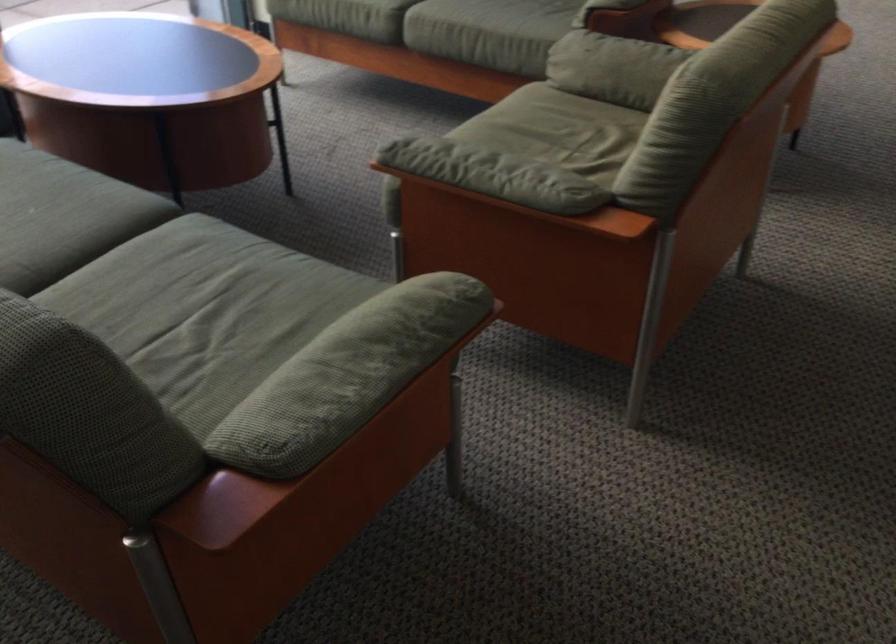
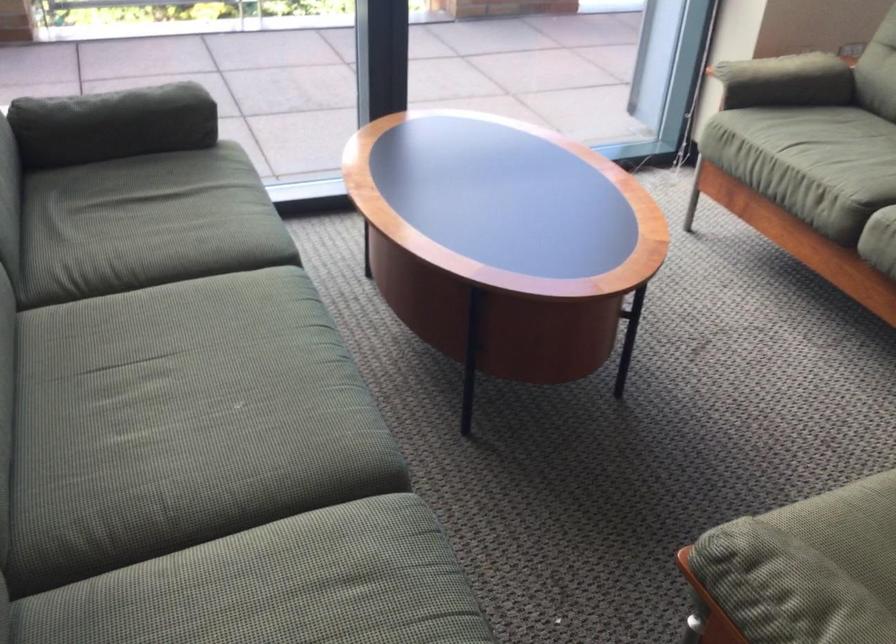
Locate, in the second image, the point that corresponds to point (434, 149) in the first image.

(785, 588)